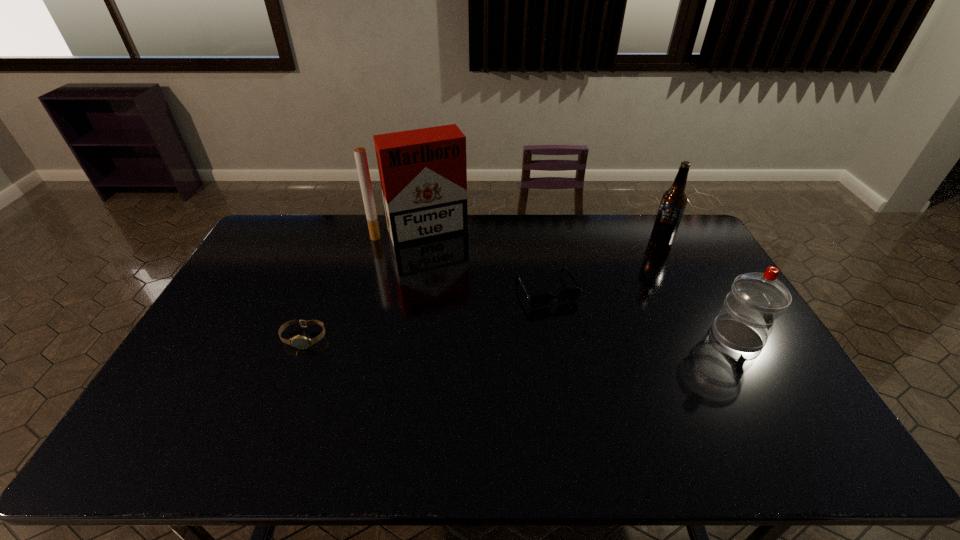
Locate an element on the screen. The width and height of the screenshot is (960, 540). beer bottle that is at the right edge is located at coordinates (673, 202).

This screenshot has width=960, height=540. What are the coordinates of `object that is positioned at the far right corner` in the screenshot? It's located at (673, 202).

What are the coordinates of `vacant region at the far edge of the desktop` in the screenshot? It's located at (530, 218).

In the image, there is a desktop. Where is `free region at the near edge`? free region at the near edge is located at coordinates (232, 412).

This screenshot has height=540, width=960. In order to click on vacant space at the left edge of the desktop in this screenshot , I will do `click(241, 285)`.

Where is `free space at the far left corner of the desktop`? free space at the far left corner of the desktop is located at coordinates (281, 224).

I want to click on vacant area at the near left corner of the desktop, so click(176, 408).

Image resolution: width=960 pixels, height=540 pixels. In the image, there is a desktop. Find the location of `free space at the far right corner`. free space at the far right corner is located at coordinates (678, 248).

At what (x,y) coordinates should I click in order to perform the action: click on free space between the cigarette case and the third nearest object. Please return your answer as a coordinate pair (x, y). Image resolution: width=960 pixels, height=540 pixels. Looking at the image, I should click on (484, 260).

Find the location of a particular element. This screenshot has width=960, height=540. vacant space that is in between the third tallest object and the watch is located at coordinates (520, 337).